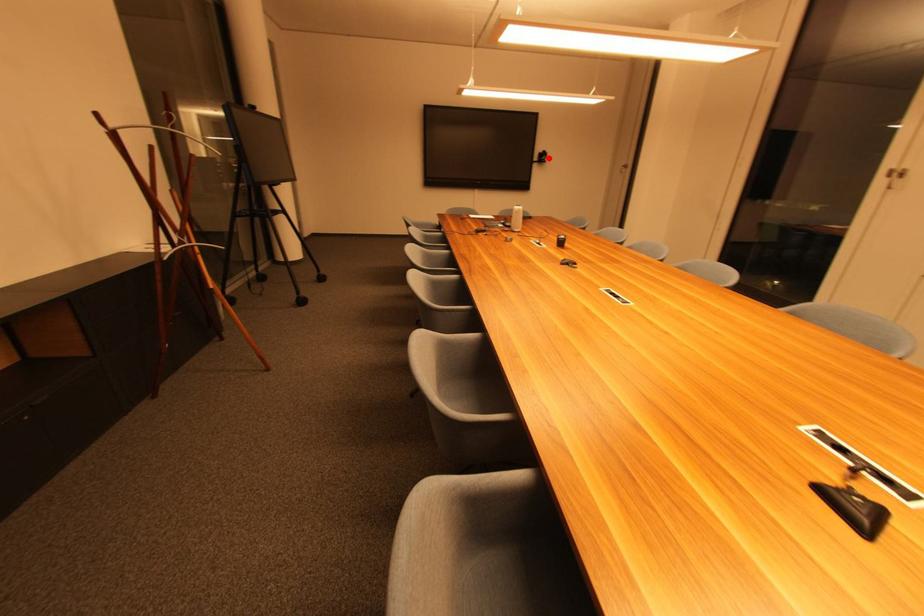
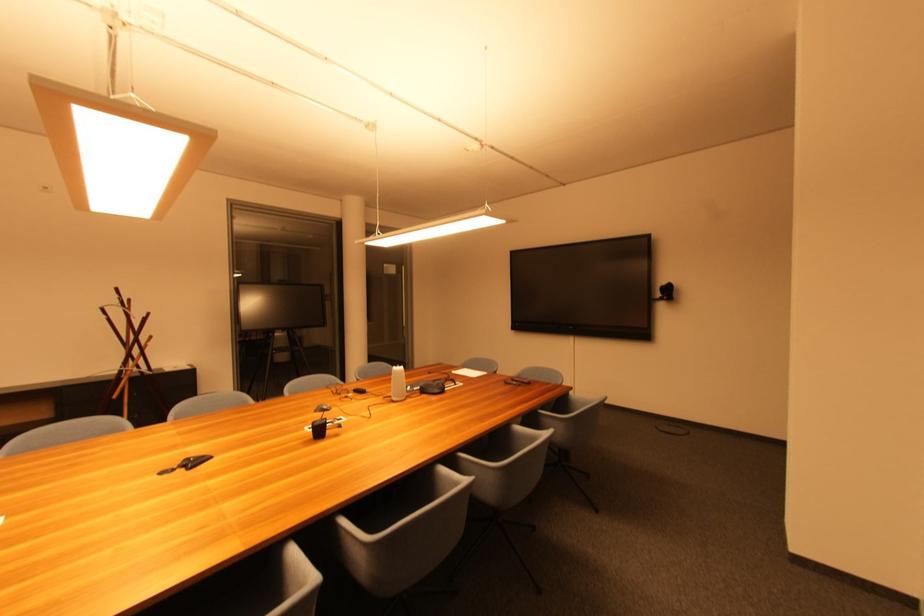
The point at the highlighted location is marked in the first image. Where is the corresponding point in the second image?

(673, 292)